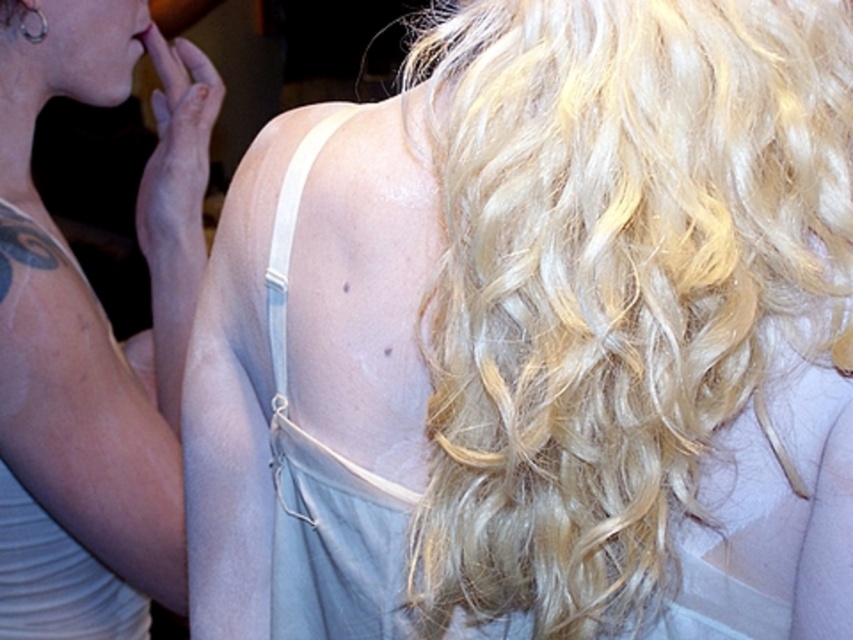
Question: Which object is positioned closest to the white matte dress at left?

Choices:
 (A) matte pink lipstick at upper left
 (B) blonde hair at upper right
 (C) silver metallic ring at upper left

Answer: (B)

Question: Can you confirm if silver metallic ring at upper left is smaller than matte pink lipstick at upper left?

Choices:
 (A) no
 (B) yes

Answer: (B)

Question: Does silver metallic ring at upper left appear over matte pink lipstick at upper left?

Choices:
 (A) yes
 (B) no

Answer: (B)

Question: Which object is positioned farthest from the white matte dress at left?

Choices:
 (A) blonde hair at upper right
 (B) silver metallic ring at upper left

Answer: (B)

Question: Which of the following is the farthest from the observer?

Choices:
 (A) (38, 13)
 (B) (138, 33)

Answer: (B)

Question: Does blonde hair at upper right appear under white matte dress at left?

Choices:
 (A) no
 (B) yes

Answer: (A)